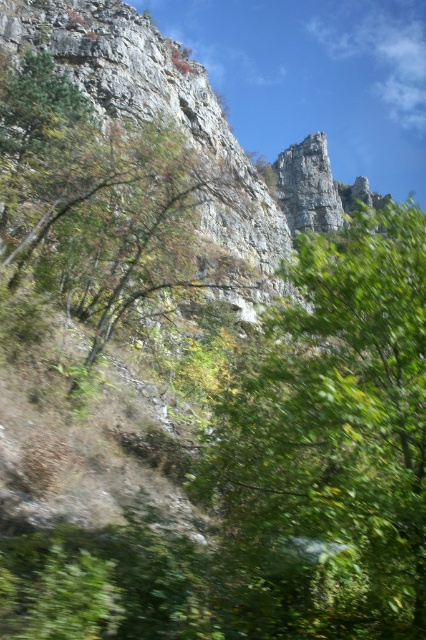
Question: Is green leafy tree at center in front of green leafy tree at upper left?

Choices:
 (A) no
 (B) yes

Answer: (B)

Question: Can you confirm if green leafy tree at center is thinner than green leafy tree at upper left?

Choices:
 (A) yes
 (B) no

Answer: (B)

Question: Can you confirm if green leafy tree at center is thinner than green leafy tree at upper left?

Choices:
 (A) yes
 (B) no

Answer: (B)

Question: Which point appears farthest from the camera in this image?

Choices:
 (A) (339, 314)
 (B) (46, 116)

Answer: (B)

Question: Which object is farther from the camera taking this photo?

Choices:
 (A) green leafy tree at upper left
 (B) green leafy tree at center

Answer: (A)